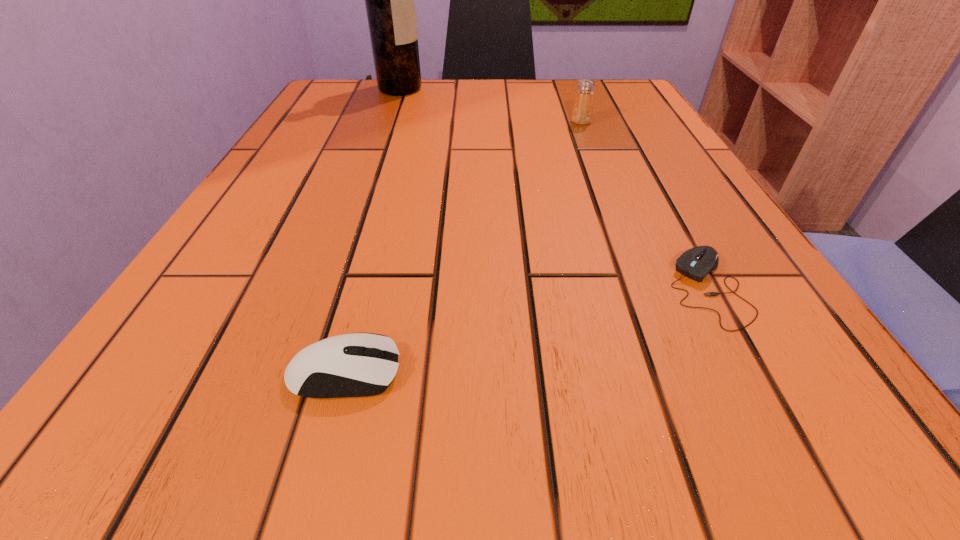
Where is `free space that satisfies the following two spatial constraints: 1. on the back side of the shorter computer mouse; 2. on the front-facing side of the tallest object`? Image resolution: width=960 pixels, height=540 pixels. free space that satisfies the following two spatial constraints: 1. on the back side of the shorter computer mouse; 2. on the front-facing side of the tallest object is located at coordinates (600, 89).

This screenshot has height=540, width=960. What are the coordinates of `vacant area that satisfies the following two spatial constraints: 1. on the front-facing side of the farthest object; 2. on the left side of the nearest object` in the screenshot? It's located at (299, 373).

The image size is (960, 540). Identify the location of vacant area that satisfies the following two spatial constraints: 1. on the front-facing side of the farthest object; 2. on the back side of the third shortest object. (389, 122).

Locate an element on the screen. The image size is (960, 540). free spot that satisfies the following two spatial constraints: 1. on the front side of the right computer mouse; 2. on the right side of the third nearest object is located at coordinates (646, 288).

Identify the location of free space in the image that satisfies the following two spatial constraints: 1. on the front-facing side of the tallest object; 2. on the right side of the nearest object. (299, 373).